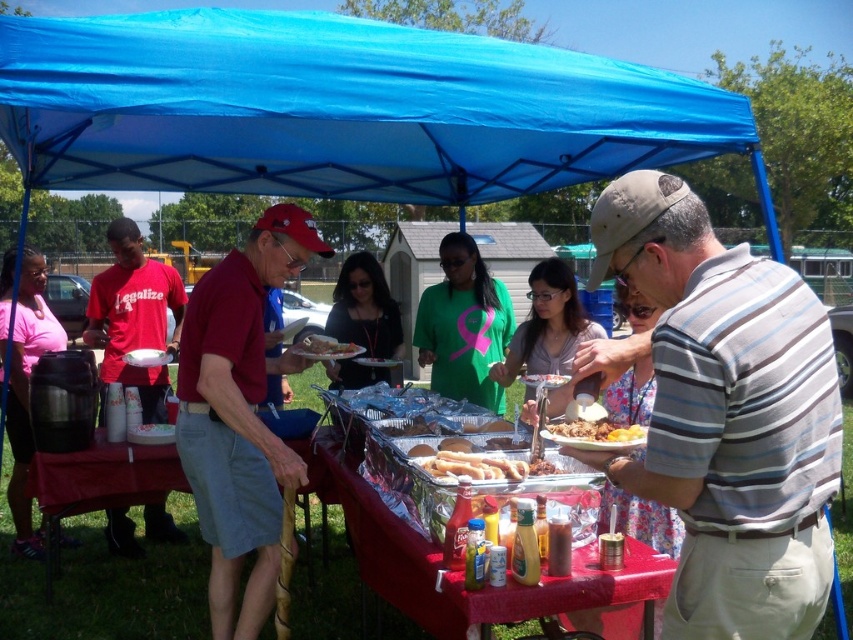
You are at the picnic table and want to grab a snack. Which item is easier to reach without moving your chair forward? The metallic silver tray at center or the green matte shirt at center?

The metallic silver tray at center is closer to the viewer than the green matte shirt at center, so it is easier to reach without moving your chair forward.

You are helping set up a picnic table and need to arrange two items on the table. You have a golden crispy chicken at center and a slightly toasted bread at center. Which item requires less space horizontally to place on the table?

The golden crispy chicken at center has a lesser width compared to the slightly toasted bread at center, so it requires less horizontal space.